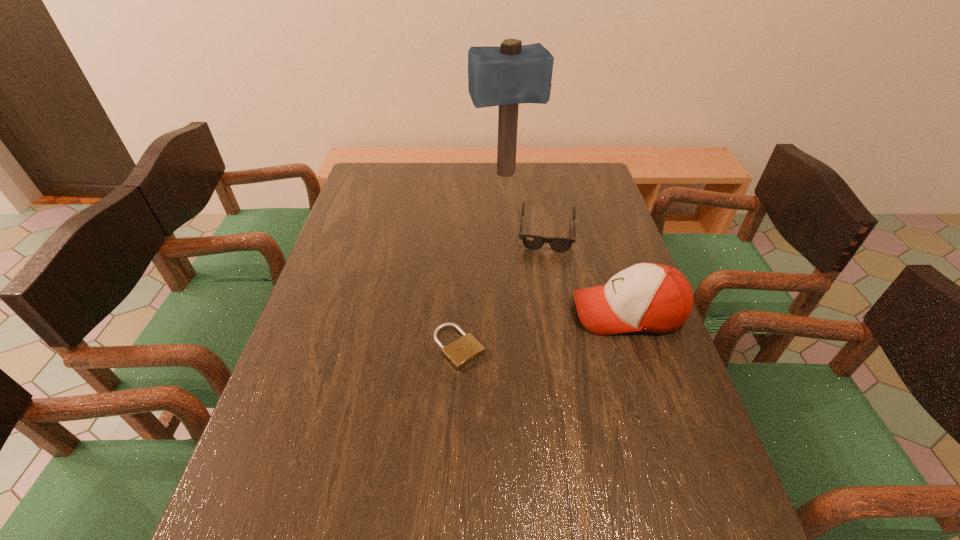
Where is `free space at the near edge`? Image resolution: width=960 pixels, height=540 pixels. free space at the near edge is located at coordinates (356, 454).

In the image, there is a desktop. Identify the location of blank space at the left edge. (354, 291).

I want to click on vacant space at the right edge of the desktop, so click(x=653, y=363).

You are a GUI agent. You are given a task and a screenshot of the screen. Output one action in this format:
    pyautogui.click(x=<x>, y=<y>)
    Task: Click on the free space at the far left corner of the desktop
    The image size is (960, 540).
    Given the screenshot: What is the action you would take?
    367,191

In the image, there is a desktop. At what (x,y) coordinates should I click in order to perform the action: click on vacant space at the near right corner. Please return your answer as a coordinate pair (x, y). Looking at the image, I should click on (639, 458).

Where is `free spot between the third nearest object and the padlock`? The width and height of the screenshot is (960, 540). free spot between the third nearest object and the padlock is located at coordinates (503, 290).

This screenshot has width=960, height=540. In order to click on vacant space that's between the mallet and the shortest object in this screenshot , I will do `click(482, 261)`.

You are a GUI agent. You are given a task and a screenshot of the screen. Output one action in this format:
    pyautogui.click(x=<x>, y=<y>)
    Task: Click on the free spot between the third nearest object and the mallet
    
    Given the screenshot: What is the action you would take?
    pyautogui.click(x=526, y=204)

Locate an element on the screen. This screenshot has height=540, width=960. vacant region between the third tallest object and the third shortest object is located at coordinates (588, 273).

Find the location of a particular element. The height and width of the screenshot is (540, 960). empty space between the baseball cap and the shortest object is located at coordinates (543, 329).